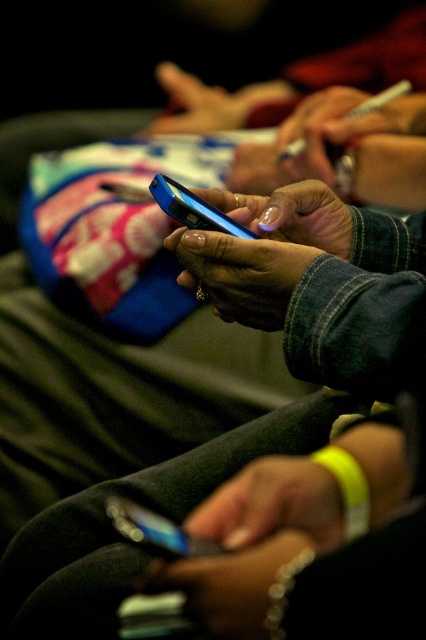
Is matte blue phone at center below shiny blue phone at center?

Incorrect, matte blue phone at center is not positioned below shiny blue phone at center.

What do you see at coordinates (261, 250) in the screenshot?
I see `matte blue phone at center` at bounding box center [261, 250].

Locate an element on the screen. This screenshot has height=640, width=426. matte blue phone at center is located at coordinates (261, 250).

Does matte black phone at center have a lesser width compared to shiny blue phone at center?

No, matte black phone at center is not thinner than shiny blue phone at center.

What do you see at coordinates (230, 582) in the screenshot?
I see `matte black phone at center` at bounding box center [230, 582].

Locate an element on the screen. This screenshot has height=640, width=426. matte black phone at center is located at coordinates (230, 582).

Is matte blue phone at center thinner than matte black phone at center?

Incorrect, matte blue phone at center's width is not less than matte black phone at center's.

Is point (284, 234) closer to camera compared to point (296, 550)?

No, (284, 234) is further to viewer.

Is point (282, 320) farther from viewer compared to point (310, 545)?

Yes, it is behind point (310, 545).

Identify the location of matte blue phone at center. (261, 250).